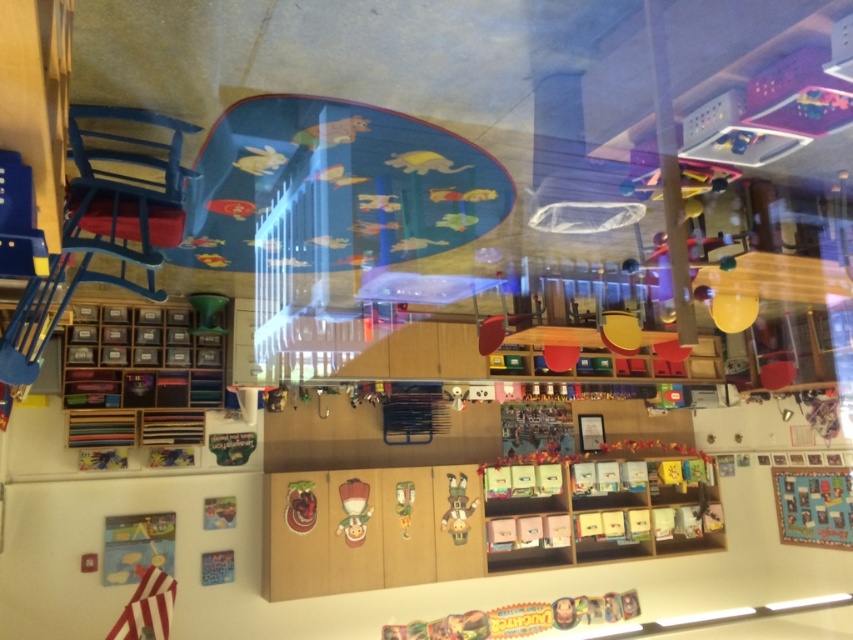
You are a teacher organizing the classroom. You need to place a new small toy on the floor. Which object, the textured fabric quilt at lower right or the matte plastic clown at center, has more space around it to accommodate the toy?

The textured fabric quilt at lower right has more space around it because its width is larger than the matte plastic clown at center, allowing for more room to place the new toy.